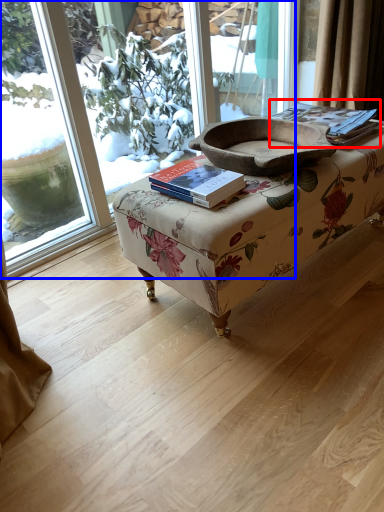
Question: Which point is closer to the camera, paperback book (highlighted by a red box) or window (highlighted by a blue box)?

Choices:
 (A) paperback book
 (B) window

Answer: (B)